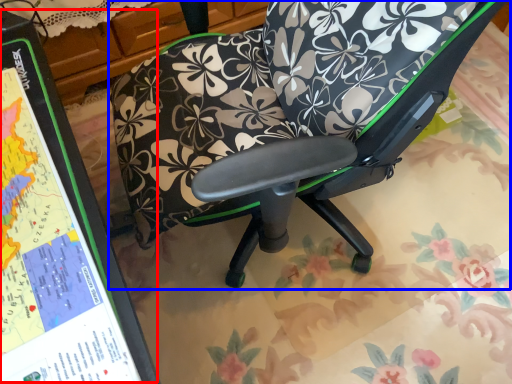
Question: Which object appears farthest to the camera in this image, bulletin board (highlighted by a red box) or chair (highlighted by a blue box)?

Choices:
 (A) bulletin board
 (B) chair

Answer: (B)